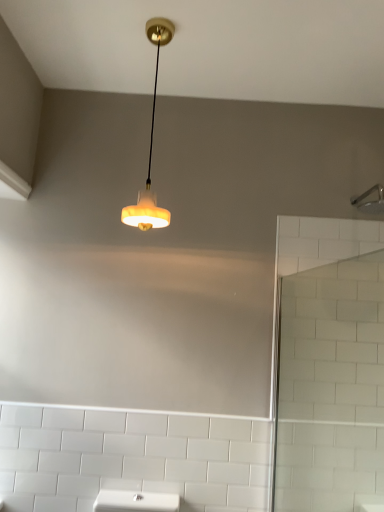
Question: From a real-world perspective, is white glass screen door at right positioned under silver metallic shower head at upper right based on gravity?

Choices:
 (A) yes
 (B) no

Answer: (A)

Question: Is white glass screen door at right to the right of silver metallic shower head at upper right from the viewer's perspective?

Choices:
 (A) yes
 (B) no

Answer: (B)

Question: Does white glass screen door at right have a larger size compared to silver metallic shower head at upper right?

Choices:
 (A) no
 (B) yes

Answer: (B)

Question: Is white glass screen door at right closer to camera compared to silver metallic shower head at upper right?

Choices:
 (A) no
 (B) yes

Answer: (B)

Question: Can you confirm if white glass screen door at right is taller than silver metallic shower head at upper right?

Choices:
 (A) yes
 (B) no

Answer: (A)

Question: Based on their sizes in the image, would you say white glass screen door at right is bigger or smaller than silver metallic shower head at upper right?

Choices:
 (A) small
 (B) big

Answer: (B)

Question: Does point (362, 234) appear closer or farther from the camera than point (375, 205)?

Choices:
 (A) closer
 (B) farther

Answer: (A)

Question: Do you think white glass screen door at right is within silver metallic shower head at upper right, or outside of it?

Choices:
 (A) inside
 (B) outside

Answer: (B)

Question: From a real-world perspective, relative to silver metallic shower head at upper right, is white glass screen door at right vertically above or below?

Choices:
 (A) below
 (B) above

Answer: (A)

Question: Would you say white glass screen door at right is to the left or to the right of matte white lampshade at upper center in the picture?

Choices:
 (A) right
 (B) left

Answer: (A)

Question: Relative to matte white lampshade at upper center, is white glass screen door at right in front or behind?

Choices:
 (A) behind
 (B) front

Answer: (B)

Question: Considering the positions of point (292, 312) and point (157, 32), is point (292, 312) closer or farther from the camera than point (157, 32)?

Choices:
 (A) farther
 (B) closer

Answer: (A)

Question: Would you say white glass screen door at right is inside or outside matte white lampshade at upper center?

Choices:
 (A) outside
 (B) inside

Answer: (A)

Question: In the image, is matte white lampshade at upper center on the left side or the right side of white glass screen door at right?

Choices:
 (A) right
 (B) left

Answer: (B)

Question: From the image's perspective, is matte white lampshade at upper center located above or below white glass screen door at right?

Choices:
 (A) above
 (B) below

Answer: (A)